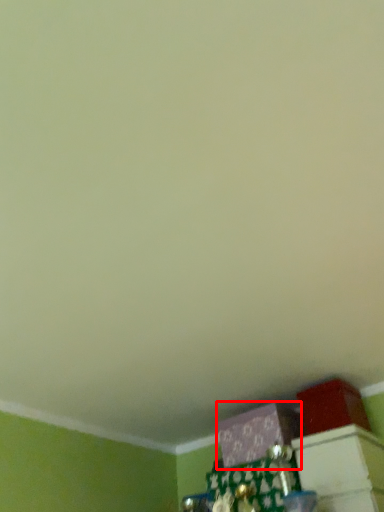
Question: From the image's perspective, what is the correct spatial positioning of box (annotated by the red box) in reference to box?

Choices:
 (A) above
 (B) below

Answer: (B)